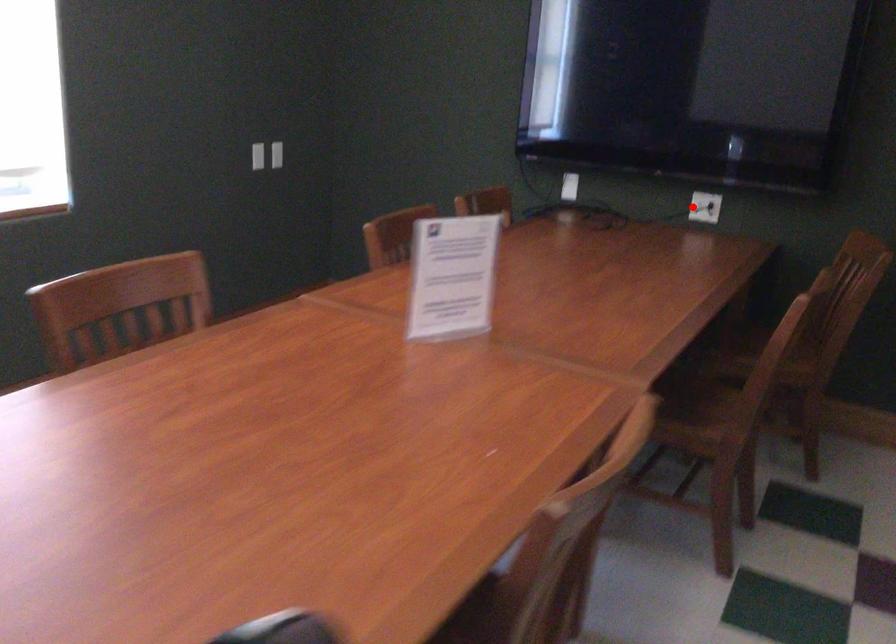
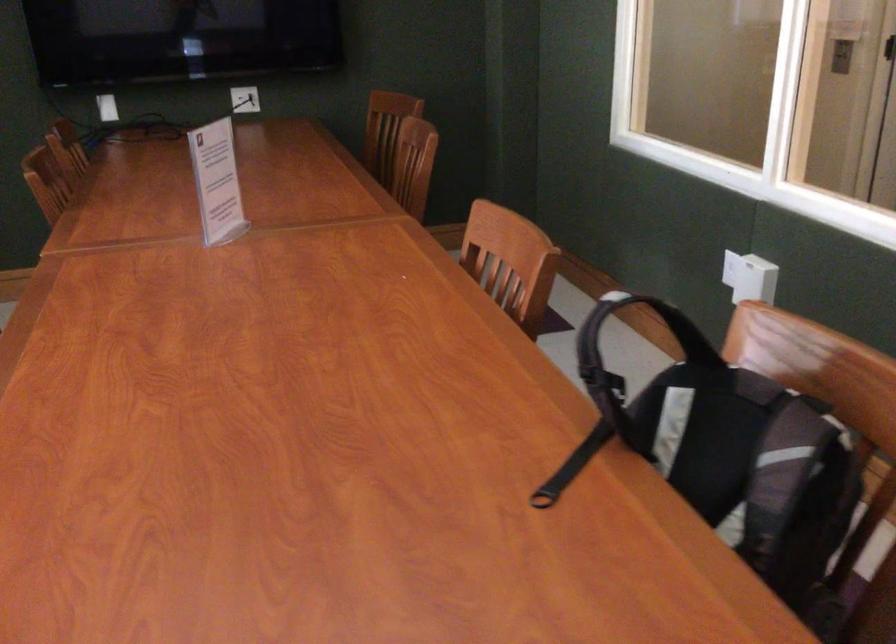
Question: I am providing you with two images of the same scene from different viewpoints. Given a red point in image1, look at the same physical point in image2. Is it:

Choices:
 (A) Closer to the viewpoint
 (B) Farther from the viewpoint

Answer: (B)